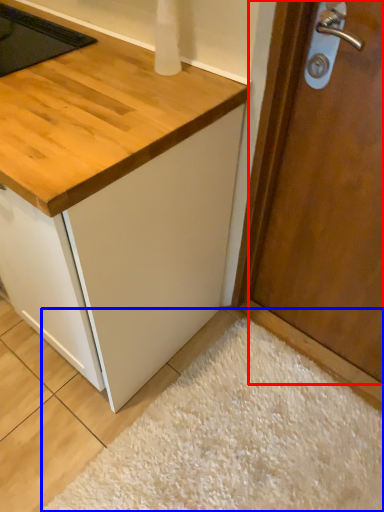
Question: Which object appears closest to the camera in this image, door (highlighted by a red box) or plain (highlighted by a blue box)?

Choices:
 (A) door
 (B) plain

Answer: (A)